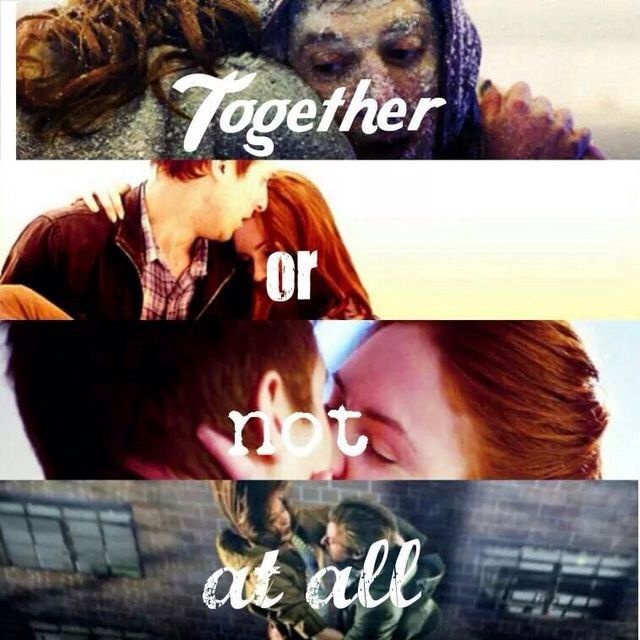
You are a GUI agent. You are given a task and a screenshot of the screen. Output one action in this format:
    pyautogui.click(x=<x>, y=<y>)
    Task: Click on the window
    Image resolution: width=640 pixels, height=640 pixels.
    Given the screenshot: What is the action you would take?
    pyautogui.click(x=91, y=529)